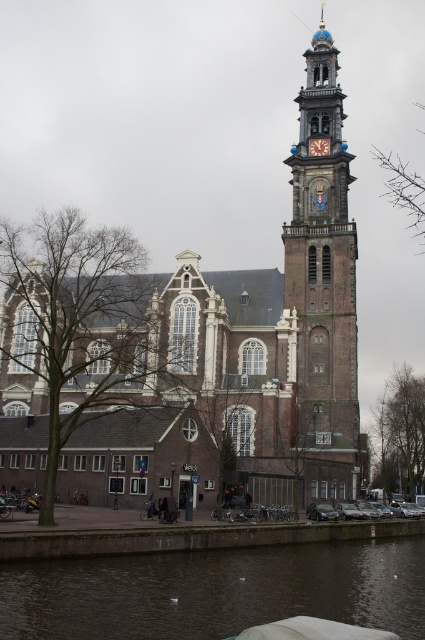
Question: Observing the image, what is the correct spatial positioning of dark brown water at lower center in reference to brown brick tower at right?

Choices:
 (A) above
 (B) below

Answer: (B)

Question: Is dark brown water at lower center wider than brown brick tower at right?

Choices:
 (A) no
 (B) yes

Answer: (B)

Question: Which object appears closest to the camera in this image?

Choices:
 (A) brown brick church at center
 (B) brown brick tower at right

Answer: (A)

Question: Estimate the real-world distances between objects in this image. Which object is farther from the brown brick tower at right?

Choices:
 (A) brown brick church at center
 (B) dark brown water at lower center

Answer: (B)

Question: Can you confirm if brown brick church at center is positioned to the right of brown brick tower at right?

Choices:
 (A) no
 (B) yes

Answer: (A)

Question: Estimate the real-world distances between objects in this image. Which object is closer to the dark brown water at lower center?

Choices:
 (A) brown brick church at center
 (B) brown brick tower at right

Answer: (A)